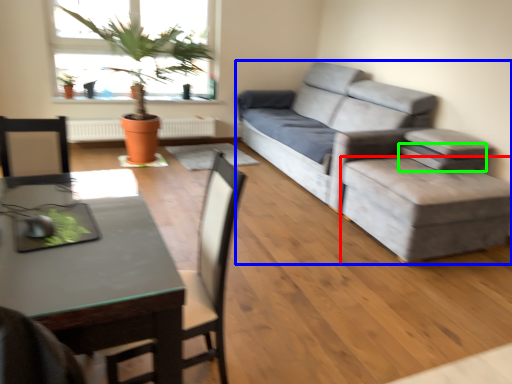
Question: Which object is the farthest from stool (highlighted by a red box)? Choose among these: studio couch (highlighted by a blue box) or pillow (highlighted by a green box).

Choices:
 (A) studio couch
 (B) pillow

Answer: (B)